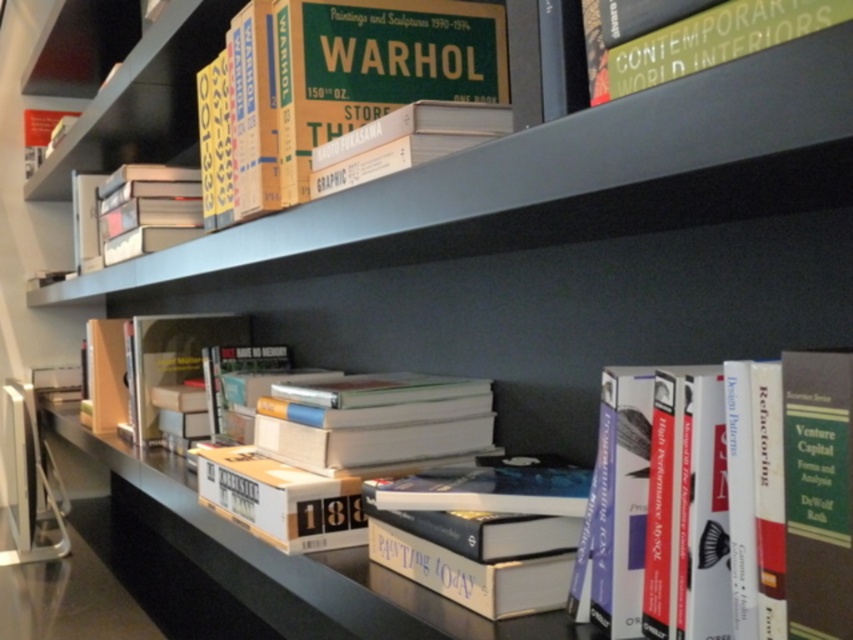
Looking at this image, which is below, hardcover book at upper center or hardcover book at upper right?

hardcover book at upper right

Based on the photo, is hardcover book at upper center bigger than hardcover book at upper right?

Correct, hardcover book at upper center is larger in size than hardcover book at upper right.

The image size is (853, 640). What do you see at coordinates (347, 76) in the screenshot?
I see `hardcover book at upper center` at bounding box center [347, 76].

This screenshot has width=853, height=640. I want to click on hardcover book at upper center, so click(347, 76).

Can you confirm if metallic gray shelf at upper center is positioned above hardcover book at center?

Yes, metallic gray shelf at upper center is above hardcover book at center.

Is metallic gray shelf at upper center taller than hardcover book at center?

No, metallic gray shelf at upper center is not taller than hardcover book at center.

The image size is (853, 640). I want to click on metallic gray shelf at upper center, so click(x=546, y=180).

At what (x,y) coordinates should I click in order to perform the action: click on metallic gray shelf at upper center. Please return your answer as a coordinate pair (x, y). The image size is (853, 640). Looking at the image, I should click on (546, 180).

Between hardcover book at center and hardcover book at upper center, which one has more height?

hardcover book at upper center

Is hardcover book at center to the left of hardcover book at upper center from the viewer's perspective?

No, hardcover book at center is not to the left of hardcover book at upper center.

Who is more distant from viewer, (724, 481) or (321, 80)?

The point (321, 80) is behind.

At what (x,y) coordinates should I click in order to perform the action: click on hardcover book at center. Please return your answer as a coordinate pair (x, y). The width and height of the screenshot is (853, 640). Looking at the image, I should click on (763, 499).